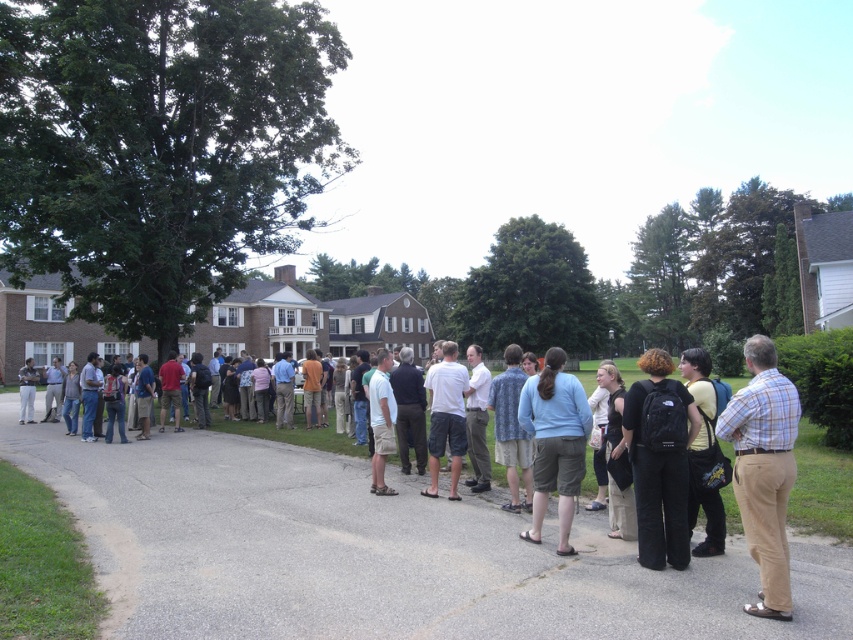
Question: Can you confirm if gray asphalt driveway at center is positioned to the left of yellow cotton shirt at center?

Choices:
 (A) yes
 (B) no

Answer: (A)

Question: Which of the following is the farthest from the observer?

Choices:
 (A) yellow cotton shirt at center
 (B) gray asphalt driveway at center
 (C) matte black jacket at center

Answer: (C)

Question: Does plaid cotton shirt at center-right appear on the left side of black backpack at center?

Choices:
 (A) no
 (B) yes

Answer: (A)

Question: Among these objects, which one is farthest from the camera?

Choices:
 (A) light blue shirt at center
 (B) light blue cotton shirt at center

Answer: (A)

Question: Does yellow cotton shirt at center lie in front of light blue shirt at center?

Choices:
 (A) yes
 (B) no

Answer: (A)

Question: Estimate the real-world distances between objects in this image. Which object is farther from the matte black jacket at center?

Choices:
 (A) light blue shirt at center
 (B) plaid cotton shirt at center-right
 (C) light blue cotton shirt at center

Answer: (B)